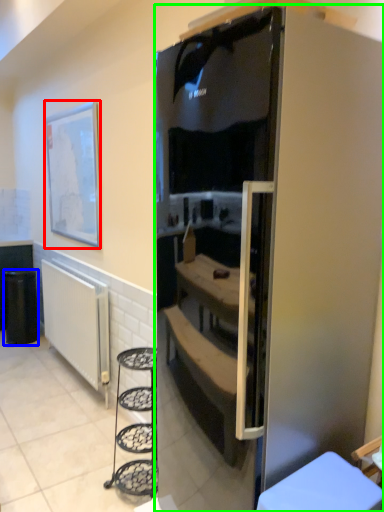
Question: Estimate the real-world distances between objects in this image. Which object is closer to picture frame (highlighted by a red box), trash bin/can (highlighted by a blue box) or refrigerator (highlighted by a green box)?

Choices:
 (A) trash bin/can
 (B) refrigerator

Answer: (A)